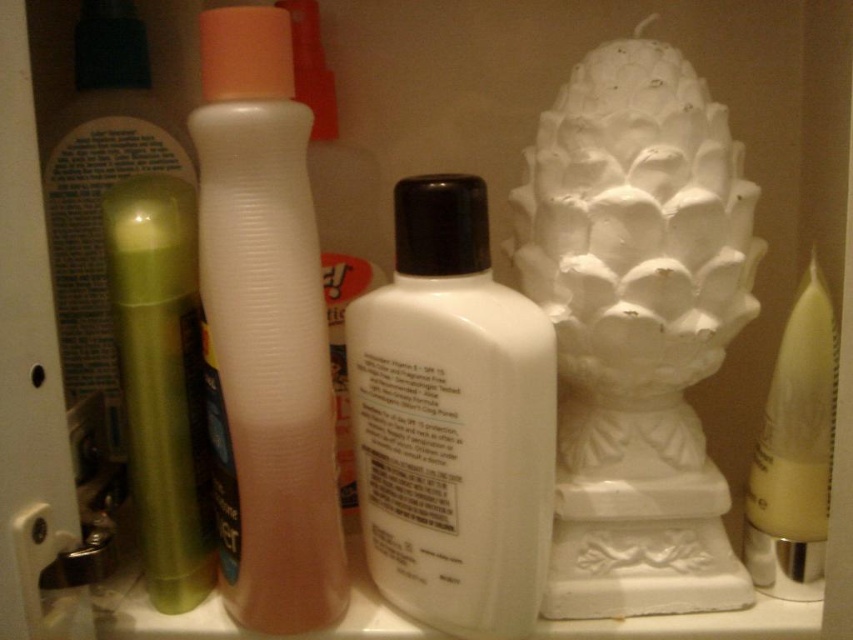
You are standing 15 inches away from a white ceramic sculpture at center right on a shelf. Can you reach it without moving closer?

The distance between you and the white ceramic sculpture at center right is 16.87 inches, so you are currently 15 inches away, which is closer than the required distance. Therefore, you can reach it without needing to move closer.

You are organizing a shelf and need to place a new item between the white matte lotion at center and the green matte tube at left. Based on their positions, where should the new item be placed?

The white matte lotion at center is above the green matte tube at left. Therefore, the new item should be placed between them either above the green matte tube at left or below the white matte lotion at center to maintain their vertical arrangement.

You are organizing a shelf and need to place a new item exactly where the white matte lotion at center is currently located. According to the image, what are the coordinates of the spot where you should place the new item?

The coordinates for the white matte lotion at center are at point (x=451, y=420).